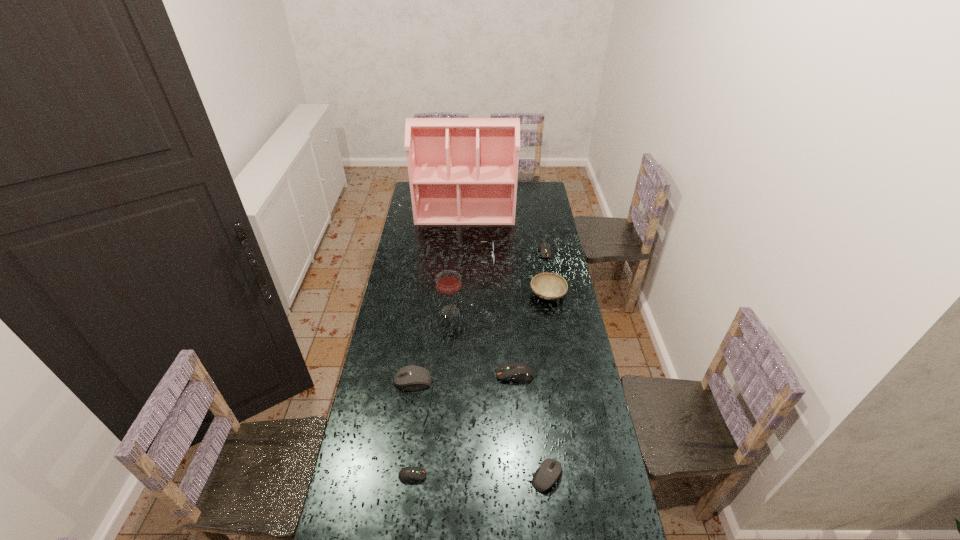
Where is `bowl that is at the right edge`? This screenshot has width=960, height=540. bowl that is at the right edge is located at coordinates (548, 286).

The image size is (960, 540). Identify the location of computer equipment situated at the right edge. (545, 251).

The height and width of the screenshot is (540, 960). I want to click on object that is positioned at the far left corner, so click(462, 171).

Locate an element on the screen. The width and height of the screenshot is (960, 540). vacant space at the far edge of the desktop is located at coordinates (517, 186).

What are the coordinates of `blank space at the left edge of the desktop` in the screenshot? It's located at (370, 397).

In the image, there is a desktop. Find the location of `vacant space at the right edge`. vacant space at the right edge is located at coordinates (561, 338).

This screenshot has width=960, height=540. Find the location of `free area in between the dollhouse and the wineglass`. free area in between the dollhouse and the wineglass is located at coordinates (458, 262).

This screenshot has width=960, height=540. What are the coordinates of `free point between the second biggest dark computer equipment and the right black computer equipment` in the screenshot? It's located at (545, 364).

Find the location of a particular element. The width and height of the screenshot is (960, 540). vacant space that's between the gray bowl and the left black computer equipment is located at coordinates (480, 338).

Where is `vacant point located between the farther black computer equipment and the black spectacles`? vacant point located between the farther black computer equipment and the black spectacles is located at coordinates (445, 320).